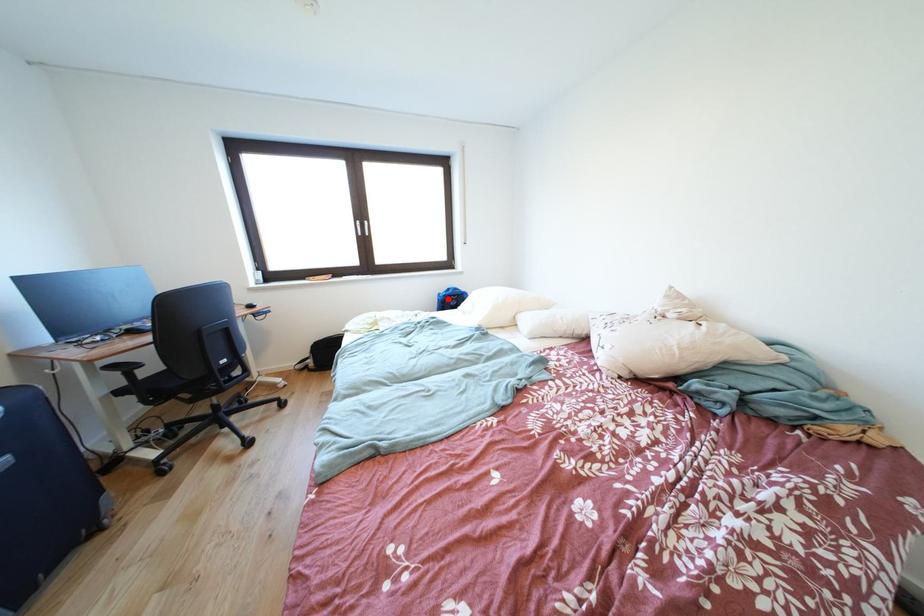
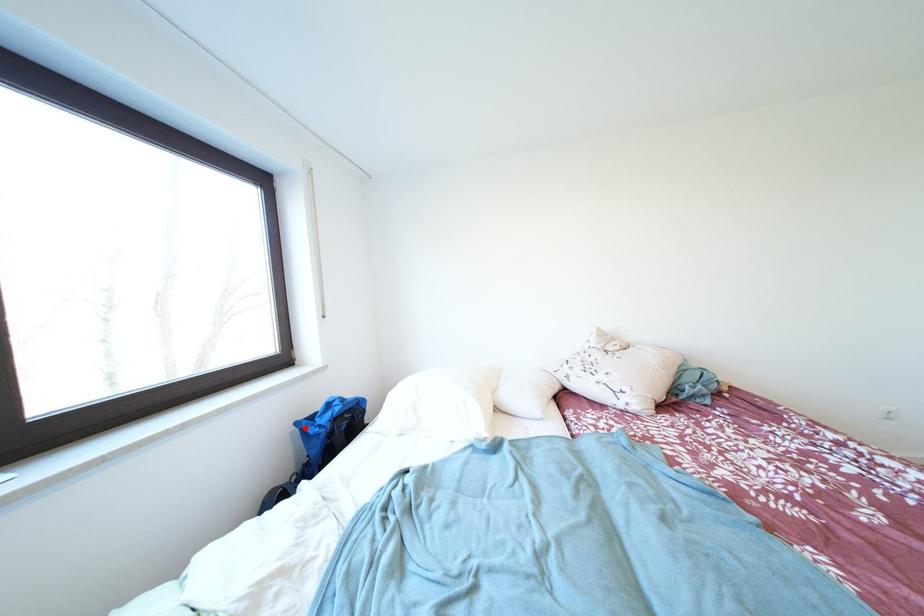
I am providing you with two images of the same scene from different viewpoints. A red point is marked on the first image and another point is marked on the second image. Is the red point in image1 aligned with the point shown in image2?

Yes